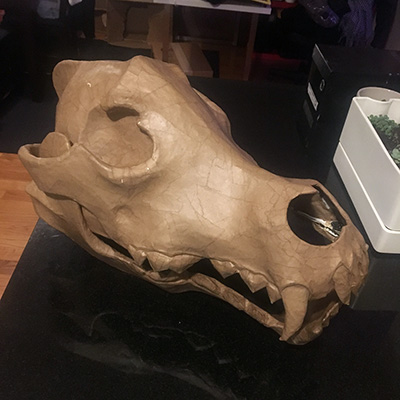
At what (x,y) coordinates should I click in order to perform the action: click on grey ceramic pot. Please return your answer as a coordinate pair (x, y). Looking at the image, I should click on (379, 91).